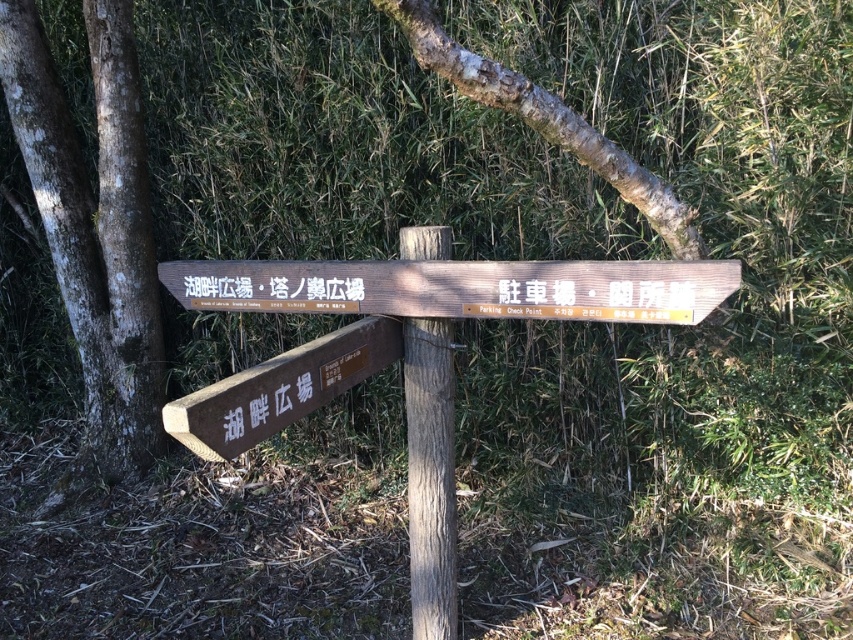
Can you confirm if wooden sign at center is positioned above brown wooden sign at lower left?

Yes.

The width and height of the screenshot is (853, 640). Describe the element at coordinates (459, 288) in the screenshot. I see `wooden sign at center` at that location.

Which is in front, point (346, 282) or point (395, 355)?

Point (346, 282)

Identify the location of wooden sign at center. The height and width of the screenshot is (640, 853). (459, 288).

In the scene shown: Is brown rough bark tree at left taller than brown wooden sign at lower left?

Correct, brown rough bark tree at left is much taller as brown wooden sign at lower left.

Between point (115, 280) and point (346, 372), which one is positioned in front?

Positioned in front is point (346, 372).

Locate an element on the screen. brown rough bark tree at left is located at coordinates (96, 225).

Does brown rough bark tree at left appear on the right side of wooden signpost at center?

No, brown rough bark tree at left is not to the right of wooden signpost at center.

The width and height of the screenshot is (853, 640). What do you see at coordinates (96, 225) in the screenshot?
I see `brown rough bark tree at left` at bounding box center [96, 225].

Is point (111, 134) farther from viewer compared to point (432, 579)?

Yes, point (111, 134) is behind point (432, 579).

Image resolution: width=853 pixels, height=640 pixels. Identify the location of brown rough bark tree at left. (96, 225).